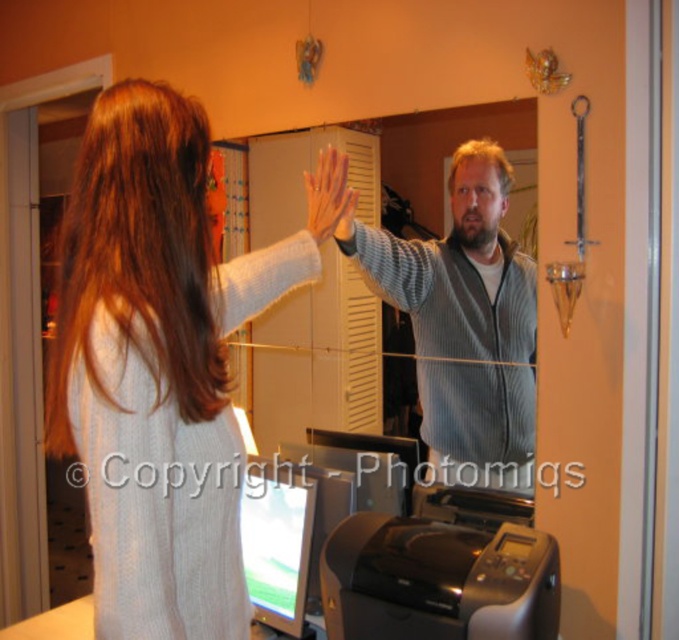
Question: Does gray ribbed sweater at center appear on the left side of matte gray sweater at upper center?

Choices:
 (A) yes
 (B) no

Answer: (B)

Question: Which of the following is the closest to the observer?

Choices:
 (A) (452, 413)
 (B) (268, 252)
 (C) (249, 564)
 (D) (494, 624)

Answer: (D)

Question: Which point is closer to the camera?

Choices:
 (A) matte gray sweater at upper center
 (B) gray ribbed sweater at center

Answer: (A)

Question: Is black plastic printer at lower center bigger than matte silver computer at lower center?

Choices:
 (A) no
 (B) yes

Answer: (B)

Question: Which of the following is the closest to the observer?

Choices:
 (A) gray ribbed sweater at center
 (B) black plastic printer at lower center
 (C) matte silver computer at lower center
 (D) white knitted sweater at upper left

Answer: (D)

Question: Is white knitted sweater at upper left further to the viewer compared to gray ribbed sweater at center?

Choices:
 (A) yes
 (B) no

Answer: (B)